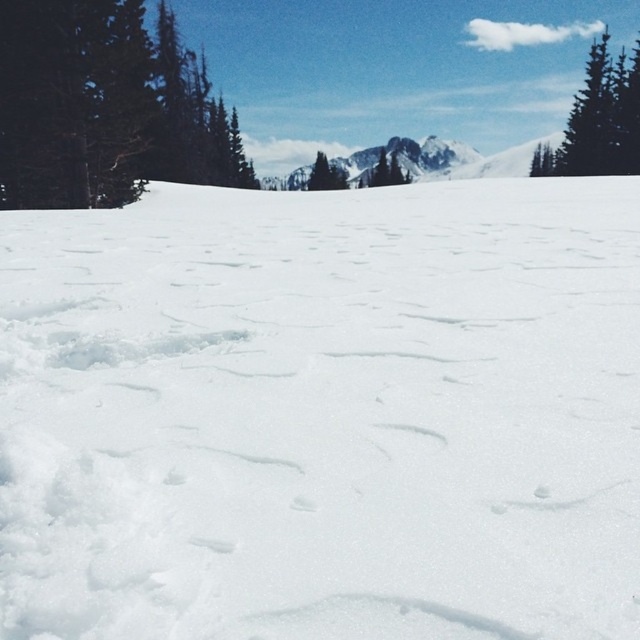
Question: Observing the image, what is the correct spatial positioning of green textured pine tree at upper right in reference to rocky gray mountain at center?

Choices:
 (A) below
 (B) above

Answer: (A)

Question: Estimate the real-world distances between objects in this image. Which object is closer to the rocky gray mountain at center?

Choices:
 (A) green textured pine tree at upper right
 (B) white fluffy snow at center
 (C) green matte tree at upper left

Answer: (A)

Question: Which object appears farthest from the camera in this image?

Choices:
 (A) white fluffy snow at center
 (B) green textured pine tree at upper right
 (C) green matte tree at upper left
 (D) rocky gray mountain at center

Answer: (D)

Question: Which is farther from the green textured pine tree at upper right?

Choices:
 (A) green matte tree at upper left
 (B) white fluffy snow at center

Answer: (B)

Question: Can you confirm if white fluffy snow at center is positioned below green matte tree at upper left?

Choices:
 (A) yes
 (B) no

Answer: (A)

Question: Can you confirm if white fluffy snow at center is bigger than green textured pine tree at upper right?

Choices:
 (A) no
 (B) yes

Answer: (A)